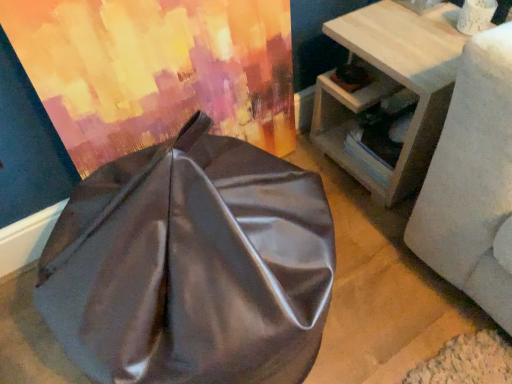
Measure the distance between point (434, 119) and camera.

A distance of 1.09 meters exists between point (434, 119) and camera.

This screenshot has height=384, width=512. I want to click on light wood side table at right, so click(392, 85).

Can we say light wood side table at right lies outside satin gray bean bag at center?

That's correct, light wood side table at right is outside of satin gray bean bag at center.

Is light wood side table at right turned away from satin gray bean bag at center?

light wood side table at right does not have its back to satin gray bean bag at center.

Does point (393, 58) lie behind point (238, 226)?

Yes, point (393, 58) is farther from viewer.

Considering the positions of objects light wood side table at right and satin gray bean bag at center in the image provided, who is more to the right, light wood side table at right or satin gray bean bag at center?

Positioned to the right is light wood side table at right.

From a real-world perspective, relative to satin fabric curtain at upper left, is light wood side table at right vertically above or below?

In terms of real-world spatial position, light wood side table at right is below satin fabric curtain at upper left.

Which object is positioned more to the left, light wood side table at right or satin fabric curtain at upper left?

satin fabric curtain at upper left.

Can we say light wood side table at right lies outside satin fabric curtain at upper left?

Yes.

Considering the positions of points (398, 14) and (151, 114), is point (398, 14) farther from camera compared to point (151, 114)?

Yes, point (398, 14) is behind point (151, 114).

In order to click on curtain behind the satin gray bean bag at center in this screenshot , I will do `click(156, 70)`.

Is satin gray bean bag at center at the right side of satin fabric curtain at upper left?

Indeed, satin gray bean bag at center is positioned on the right side of satin fabric curtain at upper left.

Is satin gray bean bag at center oriented away from satin fabric curtain at upper left?

No, satin gray bean bag at center is not facing the opposite direction of satin fabric curtain at upper left.

Which of these two, satin fabric curtain at upper left or light wood side table at right, is wider?

Wider between the two is light wood side table at right.

Between point (55, 76) and point (396, 35), which one is positioned in front?

Positioned in front is point (55, 76).

From the picture: Is satin fabric curtain at upper left further to the viewer compared to light wood side table at right?

No, it is in front of light wood side table at right.

Considering the relative positions of satin fabric curtain at upper left and light wood side table at right in the image provided, is satin fabric curtain at upper left to the right of light wood side table at right from the viewer's perspective?

No, satin fabric curtain at upper left is not to the right of light wood side table at right.

In the image, is satin fabric curtain at upper left on the left side or the right side of satin gray bean bag at center?

Clearly, satin fabric curtain at upper left is on the left of satin gray bean bag at center in the image.

Considering the relative sizes of satin fabric curtain at upper left and satin gray bean bag at center in the image provided, is satin fabric curtain at upper left wider than satin gray bean bag at center?

No.

From the picture: Which is correct: satin fabric curtain at upper left is inside satin gray bean bag at center, or outside of it?

satin fabric curtain at upper left lies outside satin gray bean bag at center.

Measure the distance between satin fabric curtain at upper left and satin gray bean bag at center.

They are 13.60 inches apart.

Considering the sizes of satin gray bean bag at center and light wood side table at right in the image, is satin gray bean bag at center wider or thinner than light wood side table at right?

Considering their sizes, satin gray bean bag at center looks broader than light wood side table at right.

Considering the positions of point (106, 352) and point (334, 111), is point (106, 352) closer or farther from the camera than point (334, 111)?

Point (106, 352) is closer to the camera than point (334, 111).

From a real-world perspective, between satin gray bean bag at center and light wood side table at right, who is vertically lower?

From a 3D spatial view, satin gray bean bag at center is below.

From the image's perspective, which is below, satin gray bean bag at center or light wood side table at right?

From the image's view, satin gray bean bag at center is below.

At what (x,y) coordinates should I click in order to perform the action: click on bean bag chair below the light wood side table at right (from a real-world perspective). Please return your answer as a coordinate pair (x, y). Looking at the image, I should click on (191, 266).

The width and height of the screenshot is (512, 384). I want to click on curtain above the light wood side table at right (from a real-world perspective), so click(156, 70).

Consider the image. Based on their spatial positions, is satin fabric curtain at upper left or satin gray bean bag at center further from light wood side table at right?

Among the two, satin gray bean bag at center is located further to light wood side table at right.

Considering their positions, is satin gray bean bag at center positioned further to light wood side table at right than satin fabric curtain at upper left?

Among the two, satin gray bean bag at center is located further to light wood side table at right.

Which object lies further to the anchor point satin fabric curtain at upper left, satin gray bean bag at center or light wood side table at right?

light wood side table at right lies further to satin fabric curtain at upper left than the other object.

Estimate the real-world distances between objects in this image. Which object is further from satin gray bean bag at center, light wood side table at right or satin fabric curtain at upper left?

Among the two, light wood side table at right is located further to satin gray bean bag at center.

Based on their spatial positions, is light wood side table at right or satin gray bean bag at center closer to satin fabric curtain at upper left?

satin gray bean bag at center is positioned closer to the anchor satin fabric curtain at upper left.

Estimate the real-world distances between objects in this image. Which object is closer to satin gray bean bag at center, satin fabric curtain at upper left or light wood side table at right?

The object closer to satin gray bean bag at center is satin fabric curtain at upper left.

Where is `bean bag chair located between satin fabric curtain at upper left and light wood side table at right in the left-right direction`? Image resolution: width=512 pixels, height=384 pixels. bean bag chair located between satin fabric curtain at upper left and light wood side table at right in the left-right direction is located at coordinates click(191, 266).